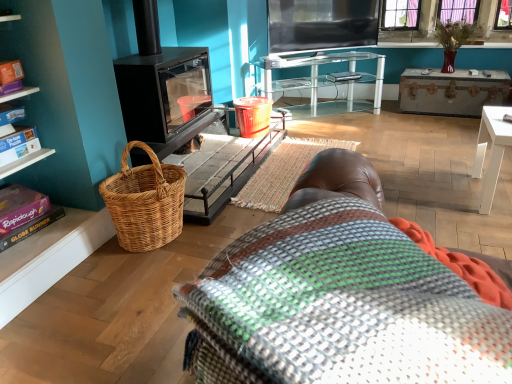
Question: Considering the relative positions of white glossy table at lower right, arranged as the first table when viewed from the right, and multicolored woven blanket at center in the image provided, is white glossy table at lower right, arranged as the first table when viewed from the right, in front of multicolored woven blanket at center?

Choices:
 (A) yes
 (B) no

Answer: (A)

Question: Is white glossy table at lower right, which is the 2th table from top to bottom, positioned with its back to multicolored woven blanket at center?

Choices:
 (A) no
 (B) yes

Answer: (A)

Question: Can you confirm if white glossy table at lower right, the 1th table viewed from the front, is positioned to the right of multicolored woven blanket at center?

Choices:
 (A) no
 (B) yes

Answer: (B)

Question: Does white glossy table at lower right, which appears as the second table when viewed from the back, appear on the left side of multicolored woven blanket at center?

Choices:
 (A) yes
 (B) no

Answer: (B)

Question: From a real-world perspective, is white glossy table at lower right, which appears as the second table when viewed from the back, located higher than multicolored woven blanket at center?

Choices:
 (A) yes
 (B) no

Answer: (A)

Question: Is white glossy table at lower right, the second table from the left, positioned behind multicolored woven blanket at center?

Choices:
 (A) no
 (B) yes

Answer: (A)

Question: Is white glossy table at lower right, the 1th table viewed from the front, shorter than rustic wooden trunk at upper right?

Choices:
 (A) no
 (B) yes

Answer: (A)

Question: Could you tell me if white glossy table at lower right, the 1th table viewed from the front, is facing rustic wooden trunk at upper right?

Choices:
 (A) yes
 (B) no

Answer: (B)

Question: Does white glossy table at lower right, the 1th table when ordered from bottom to top, touch rustic wooden trunk at upper right?

Choices:
 (A) no
 (B) yes

Answer: (A)

Question: Is white glossy table at lower right, which appears as the second table when viewed from the back, smaller than rustic wooden trunk at upper right?

Choices:
 (A) yes
 (B) no

Answer: (A)

Question: Is white glossy table at lower right, the second table from the left, further to camera compared to rustic wooden trunk at upper right?

Choices:
 (A) yes
 (B) no

Answer: (B)

Question: Can you confirm if white glossy table at lower right, the 1th table viewed from the front, is taller than rustic wooden trunk at upper right?

Choices:
 (A) no
 (B) yes

Answer: (B)

Question: Can you confirm if multicolored woven blanket at center is bigger than purple matte book at lower left?

Choices:
 (A) no
 (B) yes

Answer: (B)